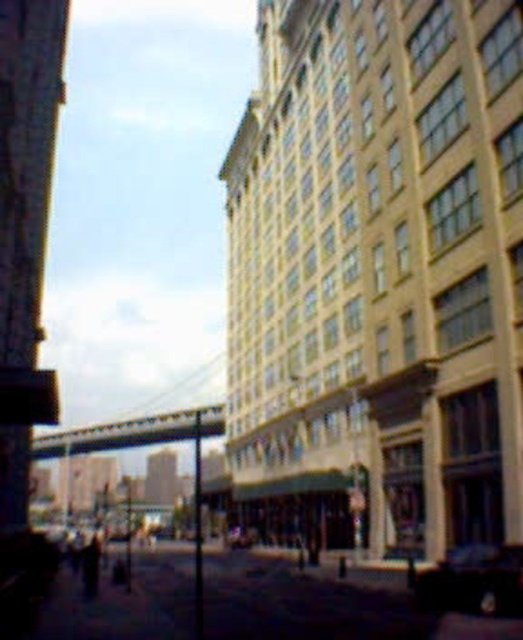
Question: Among these points, which one is nearest to the camera?

Choices:
 (A) (230, 547)
 (B) (456, 566)

Answer: (B)

Question: Can you confirm if shiny black car at lower right is positioned to the left of shiny silver car at center?

Choices:
 (A) yes
 (B) no

Answer: (B)

Question: Is shiny black car at lower right above shiny silver car at center?

Choices:
 (A) no
 (B) yes

Answer: (B)

Question: Considering the relative positions of shiny black car at lower right and shiny silver car at center in the image provided, where is shiny black car at lower right located with respect to shiny silver car at center?

Choices:
 (A) above
 (B) below

Answer: (A)

Question: Which object is closer to the camera taking this photo?

Choices:
 (A) shiny silver car at center
 (B) shiny black car at lower right

Answer: (B)